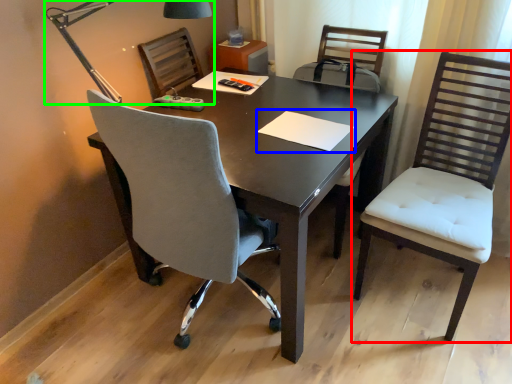
Question: Considering the real-world distances, which object is closest to chair (highlighted by a red box)? notepad (highlighted by a blue box) or lamp (highlighted by a green box).

Choices:
 (A) notepad
 (B) lamp

Answer: (A)